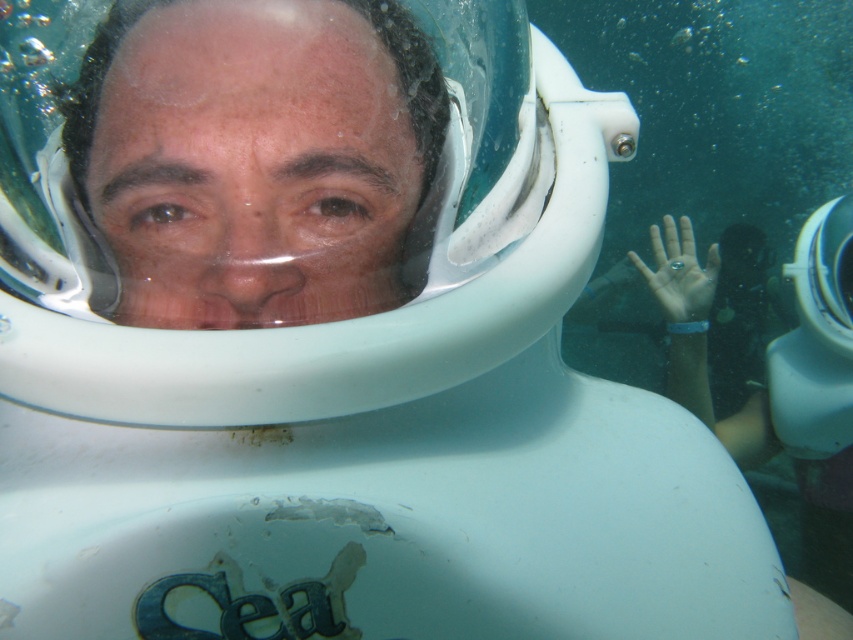
Question: Among these objects, which one is nearest to the camera?

Choices:
 (A) matte plastic face at center
 (B) clear plastic ring at center

Answer: (A)

Question: Is matte plastic face at center further to camera compared to clear plastic ring at center?

Choices:
 (A) yes
 (B) no

Answer: (B)

Question: Is matte plastic face at center positioned at the back of clear plastic ring at center?

Choices:
 (A) yes
 (B) no

Answer: (B)

Question: Does matte plastic face at center have a smaller size compared to clear plastic ring at center?

Choices:
 (A) yes
 (B) no

Answer: (A)